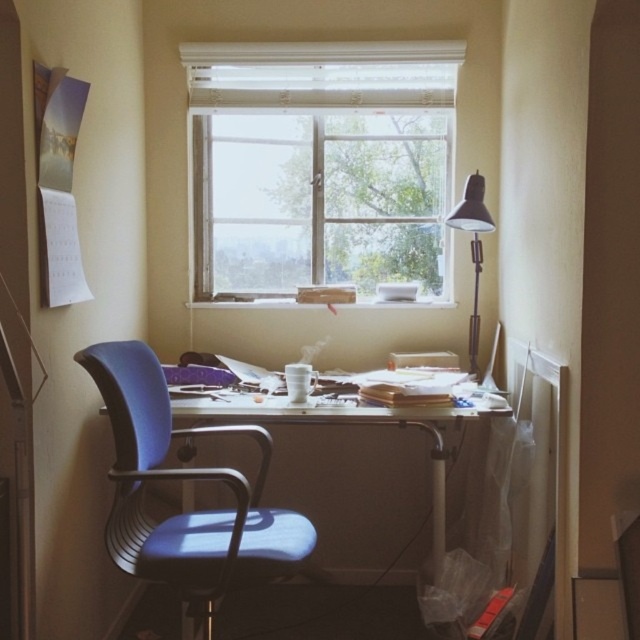
You are sitting in the blue fabric swivel chair at left and want to reach the blue fabric computer desk at center. Which direction should you move to get closer to the desk?

Since the blue fabric swivel chair at left is in front of the blue fabric computer desk at center, you should move backward to get closer to the desk.